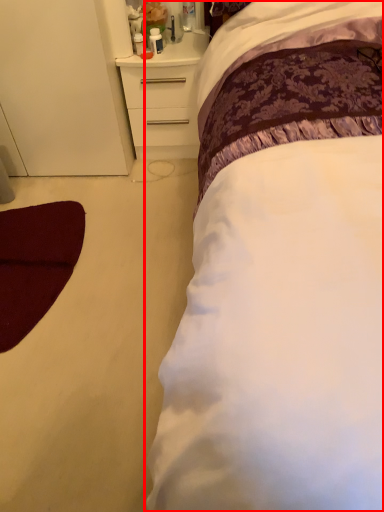
Question: From the image's perspective, what is the correct spatial relationship of bed (annotated by the red box) in relation to chest of drawers?

Choices:
 (A) above
 (B) below

Answer: (B)